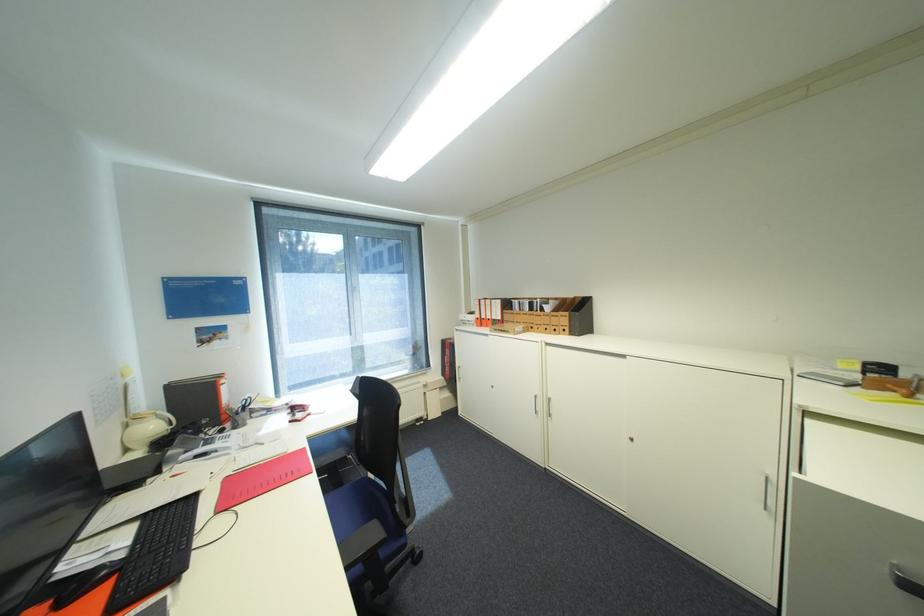
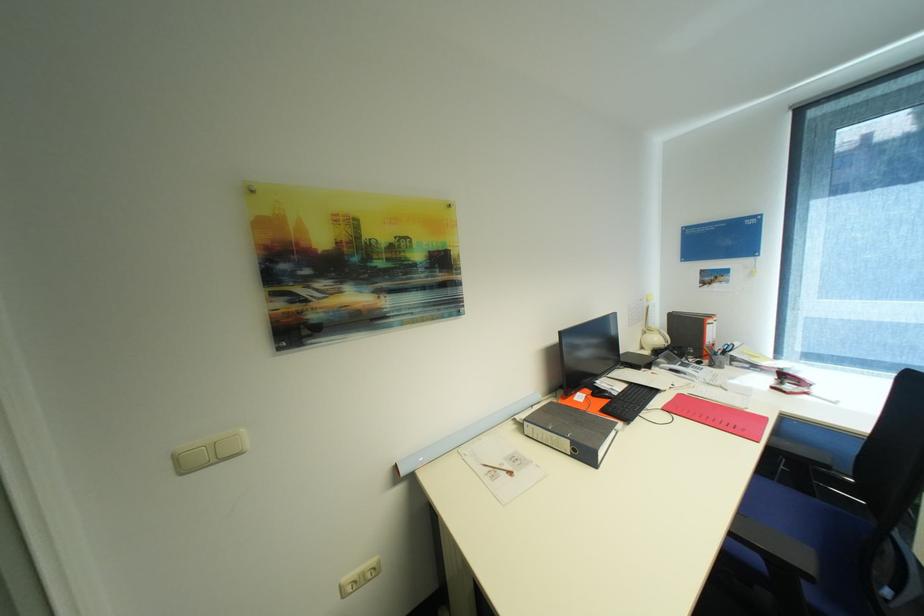
Locate, in the second image, the point that corresponds to point (317, 415) in the first image.

(813, 394)